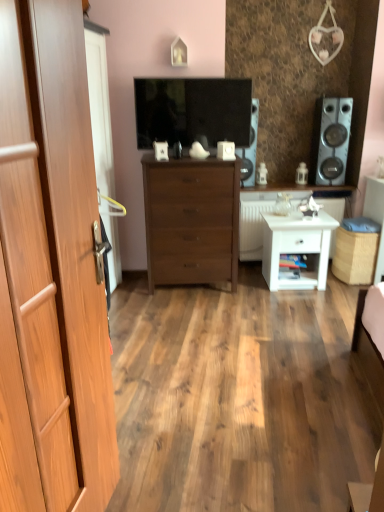
Locate an element on the screen. vacant area that is in front of white matte nightstand at lower right is located at coordinates (298, 300).